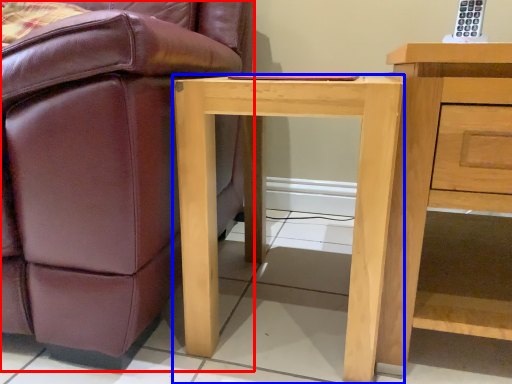
Question: Which of the following is the farthest to the observer, chair (highlighted by a red box) or desk (highlighted by a blue box)?

Choices:
 (A) chair
 (B) desk

Answer: (B)